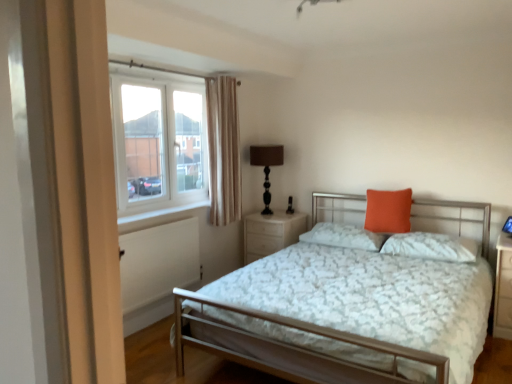
Question: From the image's perspective, is orange matte pillow at upper right, the second pillow when ordered from right to left, positioned above or below brown fabric-covered lamp at upper right?

Choices:
 (A) below
 (B) above

Answer: (A)

Question: Which is correct: orange matte pillow at upper right, the second pillow when ordered from right to left, is inside brown fabric-covered lamp at upper right, or outside of it?

Choices:
 (A) inside
 (B) outside

Answer: (B)

Question: Estimate the real-world distances between objects in this image. Which object is closer to the pine wood nightstand at center?

Choices:
 (A) orange fabric pillow at center, which appears as the third pillow when viewed from the right
 (B) clear glass window at upper left
 (C) beige fabric curtain at upper left
 (D) metallic silver bed at center
 (E) white painted wood at lower left

Answer: (A)

Question: Considering the real-world distances, which object is farthest from the beige fabric curtain at upper left?

Choices:
 (A) orange matte pillow at upper right, the second pillow when ordered from right to left
 (B) metallic silver bed at center
 (C) brown fabric-covered lamp at upper right
 (D) pine wood nightstand at center
 (E) orange fabric pillow at center, the 1th pillow from the left

Answer: (B)